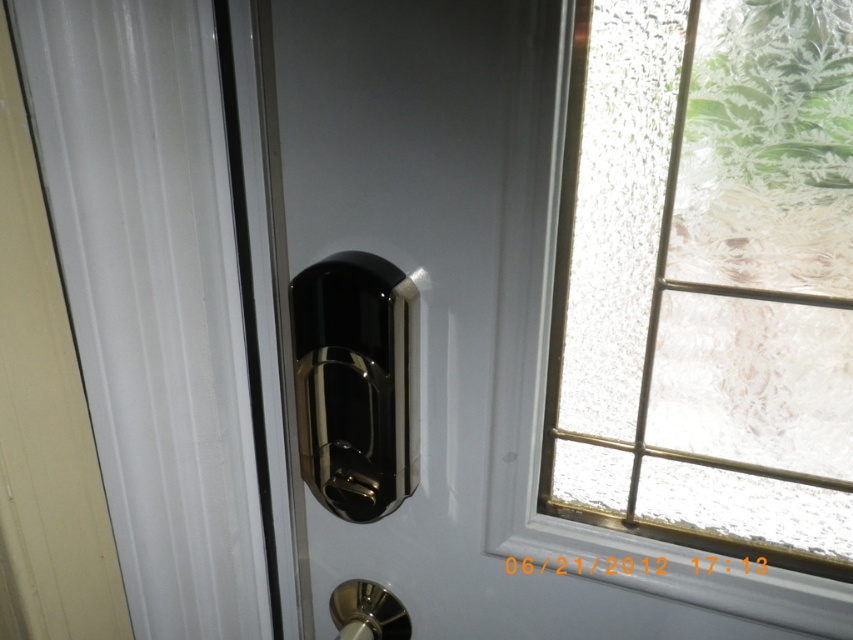
Is glossy metallic door handle at center bigger than polished metal door handle at lower center?

Indeed, glossy metallic door handle at center has a larger size compared to polished metal door handle at lower center.

Does glossy metallic door handle at center have a lesser width compared to polished metal door handle at lower center?

No.

Who is more distant from viewer, (368, 289) or (387, 593)?

The point (387, 593) is behind.

Identify the location of glossy metallic door handle at center. (357, 381).

Can you confirm if glossy metallic lock at center is shorter than glossy metallic door handle at center?

No, glossy metallic lock at center is not shorter than glossy metallic door handle at center.

Does glossy metallic lock at center appear on the left side of glossy metallic door handle at center?

No, glossy metallic lock at center is not to the left of glossy metallic door handle at center.

Measure the distance between glossy metallic lock at center and camera.

A distance of 18.77 inches exists between glossy metallic lock at center and camera.

Identify the location of glossy metallic lock at center. (454, 323).

Is frosted glass window at upper right to the right of glossy metallic door handle at center from the viewer's perspective?

Indeed, frosted glass window at upper right is positioned on the right side of glossy metallic door handle at center.

Does frosted glass window at upper right have a greater width compared to glossy metallic door handle at center?

Yes.

Is point (675, 464) in front of point (297, 387)?

No, it is not.

What are the coordinates of `frosted glass window at upper right` in the screenshot? It's located at (711, 276).